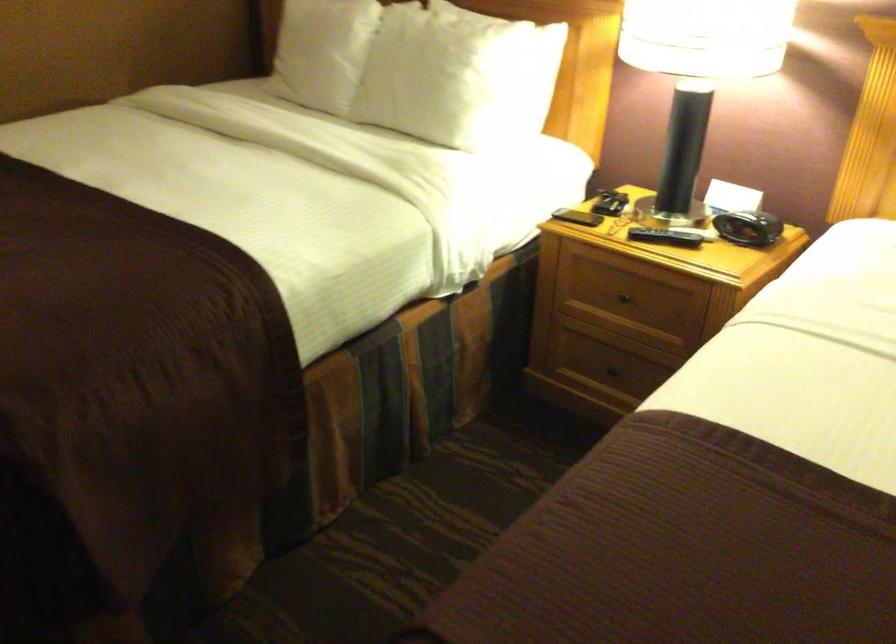
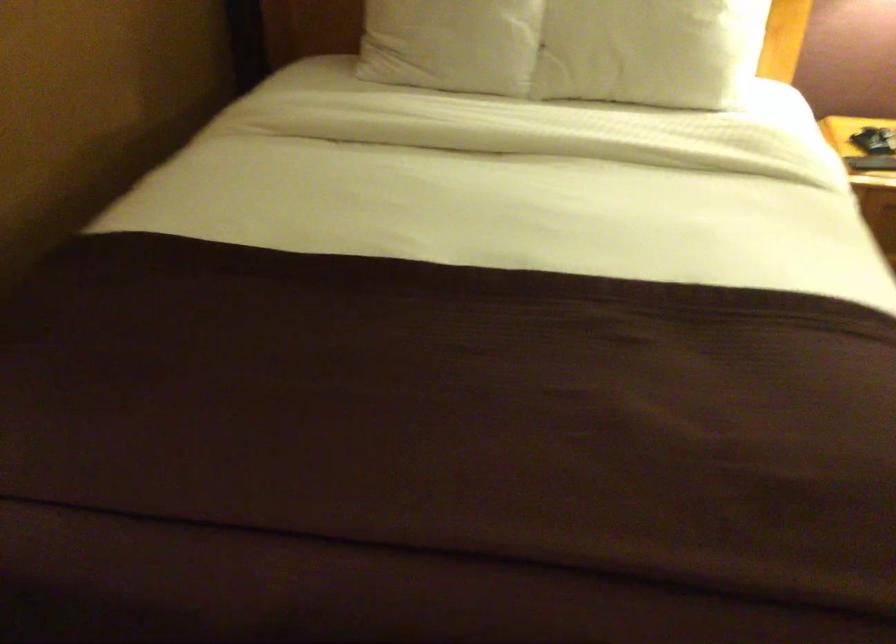
Locate, in the second image, the point that corresponds to point (410, 91) in the first image.

(649, 51)